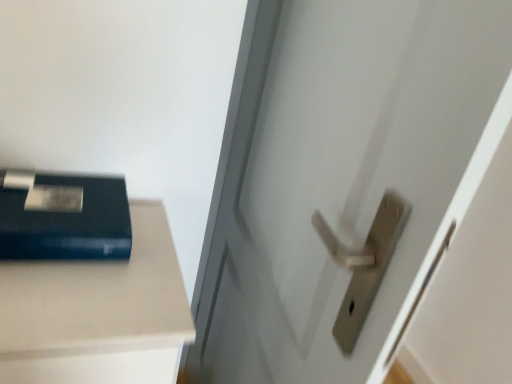
Question: Is satin silver handle at center thinner than matte black book at upper left?

Choices:
 (A) yes
 (B) no

Answer: (A)

Question: From a real-world perspective, is satin silver handle at center located beneath matte black book at upper left?

Choices:
 (A) yes
 (B) no

Answer: (A)

Question: Is matte black book at upper left at the back of satin silver handle at center?

Choices:
 (A) yes
 (B) no

Answer: (A)

Question: Is satin silver handle at center bigger than matte black book at upper left?

Choices:
 (A) no
 (B) yes

Answer: (B)

Question: Does satin silver handle at center appear on the left side of matte black book at upper left?

Choices:
 (A) yes
 (B) no

Answer: (B)

Question: Is satin silver handle at center outside matte black book at upper left?

Choices:
 (A) no
 (B) yes

Answer: (B)

Question: Is matte black book at upper left far away from satin silver handle at center?

Choices:
 (A) no
 (B) yes

Answer: (A)

Question: Can you confirm if matte black book at upper left is taller than satin silver handle at center?

Choices:
 (A) yes
 (B) no

Answer: (B)

Question: Is matte black book at upper left positioned behind satin silver handle at center?

Choices:
 (A) no
 (B) yes

Answer: (B)

Question: Is matte black book at upper left in contact with satin silver handle at center?

Choices:
 (A) no
 (B) yes

Answer: (A)

Question: Is matte black book at upper left not inside satin silver handle at center?

Choices:
 (A) no
 (B) yes

Answer: (B)

Question: Does matte black book at upper left have a larger size compared to satin silver handle at center?

Choices:
 (A) no
 (B) yes

Answer: (A)

Question: Based on their positions, is satin silver handle at center located to the left or right of matte black book at upper left?

Choices:
 (A) right
 (B) left

Answer: (A)